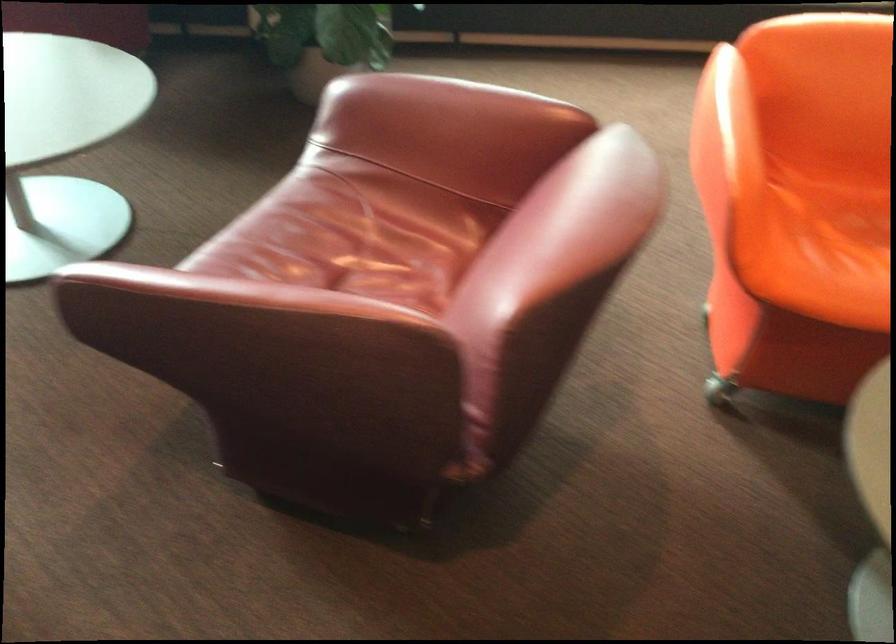
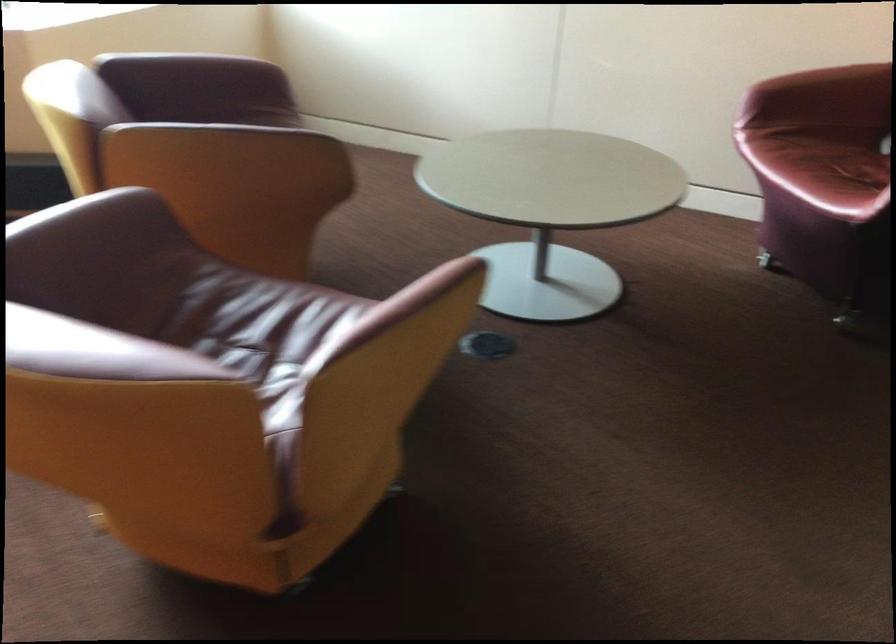
Question: In a continuous first-person perspective shot, in which direction is the camera moving?

Choices:
 (A) Left
 (B) Right
 (C) Forward
 (D) Backward

Answer: (B)